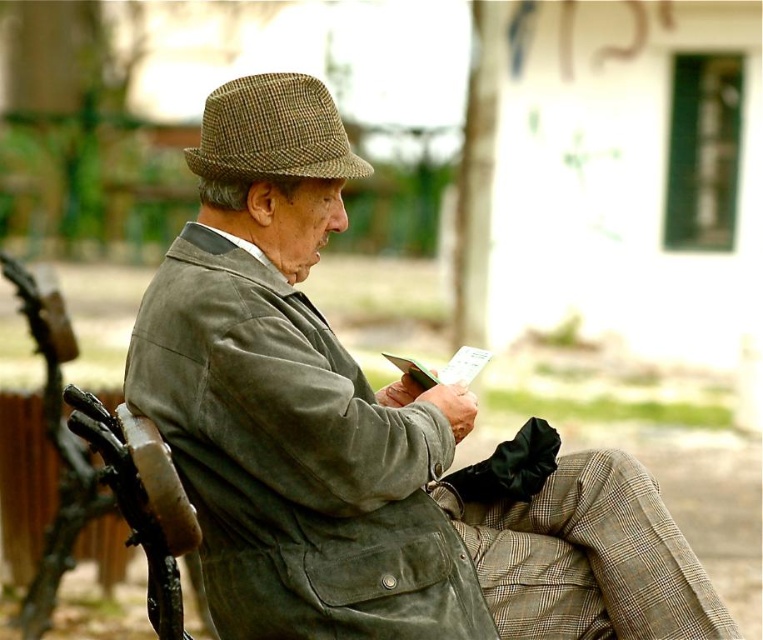
Between point (509, 554) and point (182, 442), which one is positioned in front?

Point (182, 442) is more forward.

Where is `matte green coat at center`? The image size is (763, 640). matte green coat at center is located at coordinates (362, 435).

How distant is green corduroy trench coat at center from brown checkered fedora at upper center?

The distance of green corduroy trench coat at center from brown checkered fedora at upper center is 17.77 inches.

Looking at this image, who is more forward, (436, 410) or (259, 106)?

Positioned in front is point (259, 106).

I want to click on green corduroy trench coat at center, so click(x=295, y=460).

Does matte green coat at center appear on the left side of brown checkered fedora at upper center?

Incorrect, matte green coat at center is not on the left side of brown checkered fedora at upper center.

Does matte green coat at center have a lesser width compared to brown checkered fedora at upper center?

No.

Between point (393, 556) and point (214, 157), which one is positioned in front?

Positioned in front is point (393, 556).

Locate an element on the screen. matte green coat at center is located at coordinates (362, 435).